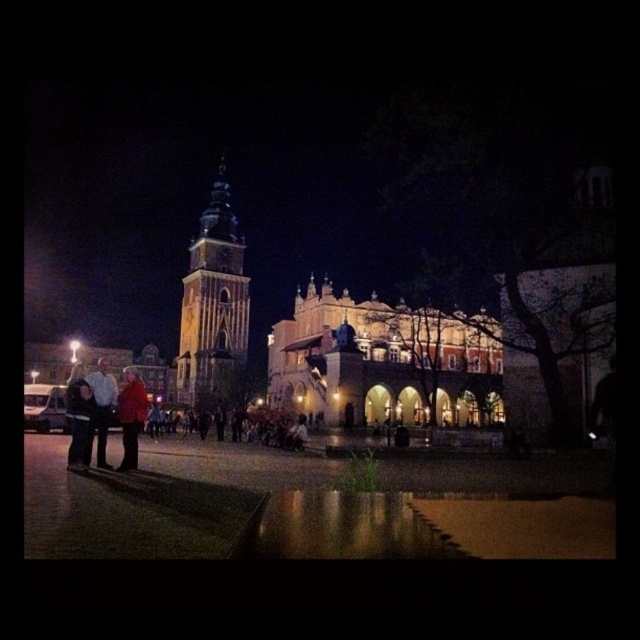
Question: Which point is farther to the camera?

Choices:
 (A) brick building at center
 (B) red wool coat at center

Answer: (B)

Question: Does brick building at center appear under blue glass bell tower at center?

Choices:
 (A) no
 (B) yes

Answer: (B)

Question: Is brick building at center smaller than red wool coat at center?

Choices:
 (A) yes
 (B) no

Answer: (B)

Question: Which object is the farthest from the red wool coat at center?

Choices:
 (A) blue glass bell tower at center
 (B) brick building at center

Answer: (B)

Question: Can you confirm if brick building at center is positioned to the left of red wool coat at center?

Choices:
 (A) no
 (B) yes

Answer: (A)

Question: Which point is farther to the camera?

Choices:
 (A) (x=132, y=426)
 (B) (x=177, y=368)

Answer: (B)